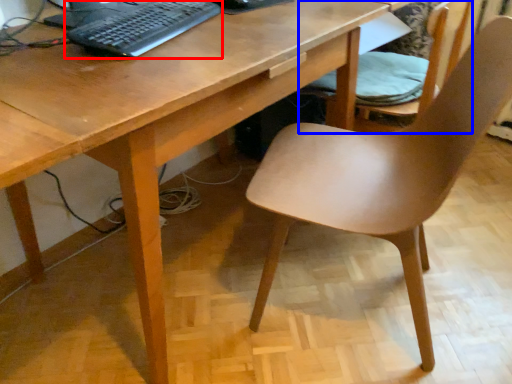
Question: Which of the following is the farthest to the observer, computer keyboard (highlighted by a red box) or chair (highlighted by a blue box)?

Choices:
 (A) computer keyboard
 (B) chair

Answer: (B)